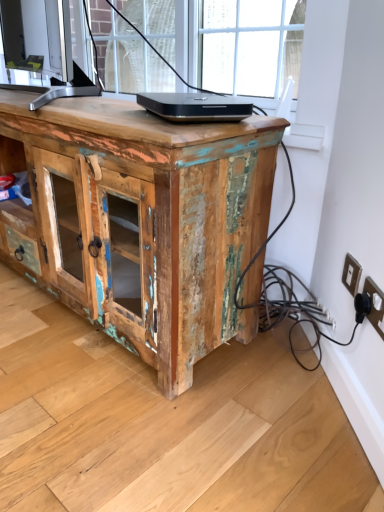
Question: From a real-world perspective, is black plastic electric outlet at lower right, the first electric outlet positioned from the front, located higher than black glossy laptop at center?

Choices:
 (A) yes
 (B) no

Answer: (B)

Question: From the image's perspective, would you say black plastic electric outlet at lower right, the first electric outlet positioned from the front, is positioned over black glossy laptop at center?

Choices:
 (A) no
 (B) yes

Answer: (A)

Question: Does black plastic electric outlet at lower right, the 2th electric outlet positioned from the back, have a lesser width compared to black glossy laptop at center?

Choices:
 (A) no
 (B) yes

Answer: (B)

Question: Is black plastic electric outlet at lower right, the 2th electric outlet positioned from the back, not near black glossy laptop at center?

Choices:
 (A) yes
 (B) no

Answer: (B)

Question: Does black plastic electric outlet at lower right, the first electric outlet positioned from the front, come behind black glossy laptop at center?

Choices:
 (A) no
 (B) yes

Answer: (A)

Question: Is black plastic electric outlet at lower right, the 2th electric outlet positioned from the back, smaller than black glossy laptop at center?

Choices:
 (A) yes
 (B) no

Answer: (A)

Question: Is white plastic electric outlet at lower right, acting as the first electric outlet starting from the back, turned away from black plastic electric outlet at lower right, the first electric outlet positioned from the front?

Choices:
 (A) yes
 (B) no

Answer: (B)

Question: Does white plastic electric outlet at lower right, acting as the first electric outlet starting from the back, appear on the right side of black plastic electric outlet at lower right, the 2th electric outlet positioned from the back?

Choices:
 (A) yes
 (B) no

Answer: (B)

Question: Considering the relative sizes of white plastic electric outlet at lower right, acting as the first electric outlet starting from the back, and black plastic electric outlet at lower right, the 2th electric outlet positioned from the back, in the image provided, is white plastic electric outlet at lower right, acting as the first electric outlet starting from the back, shorter than black plastic electric outlet at lower right, the 2th electric outlet positioned from the back,?

Choices:
 (A) yes
 (B) no

Answer: (A)

Question: Is white plastic electric outlet at lower right, acting as the first electric outlet starting from the back, wider than black plastic electric outlet at lower right, the first electric outlet positioned from the front?

Choices:
 (A) no
 (B) yes

Answer: (A)

Question: Does white plastic electric outlet at lower right, the second electric outlet when ordered from front to back, lie in front of black plastic electric outlet at lower right, the 2th electric outlet positioned from the back?

Choices:
 (A) no
 (B) yes

Answer: (A)

Question: From a real-world perspective, is white plastic electric outlet at lower right, the second electric outlet when ordered from front to back, positioned under black plastic electric outlet at lower right, the 2th electric outlet positioned from the back, based on gravity?

Choices:
 (A) yes
 (B) no

Answer: (B)

Question: Is white plastic electric outlet at lower right, the second electric outlet when ordered from front to back, further to camera compared to weathered wood cabinet at center?

Choices:
 (A) no
 (B) yes

Answer: (B)